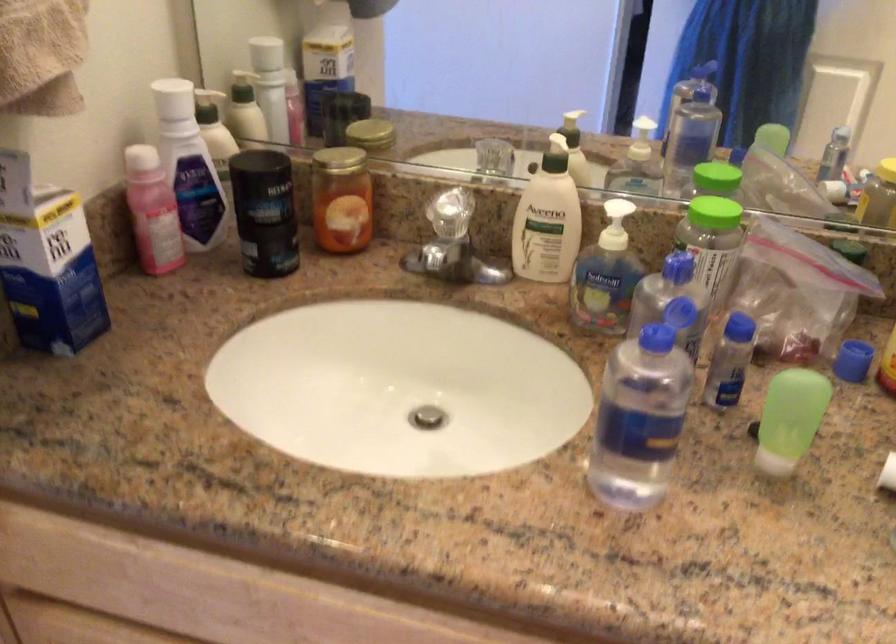
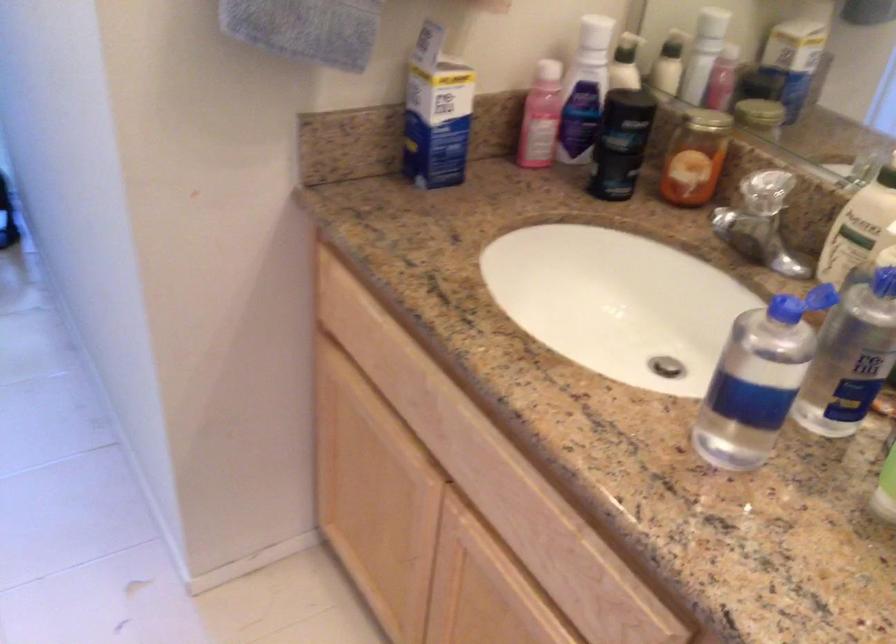
Question: Based on the continuous images, in which direction is the camera rotating? Reply with the corresponding letter.

Choices:
 (A) Left
 (B) Right
 (C) Up
 (D) Down

Answer: (A)